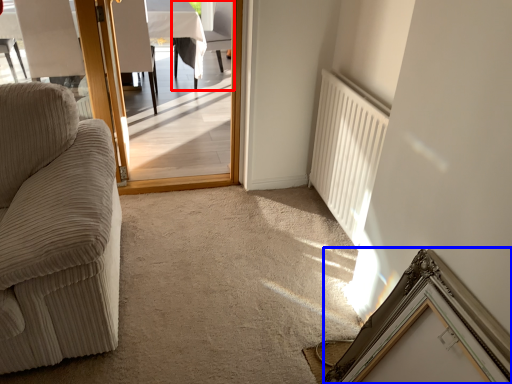
Question: Among these objects, which one is farthest to the camera, chair (highlighted by a red box) or picture frame (highlighted by a blue box)?

Choices:
 (A) chair
 (B) picture frame

Answer: (A)